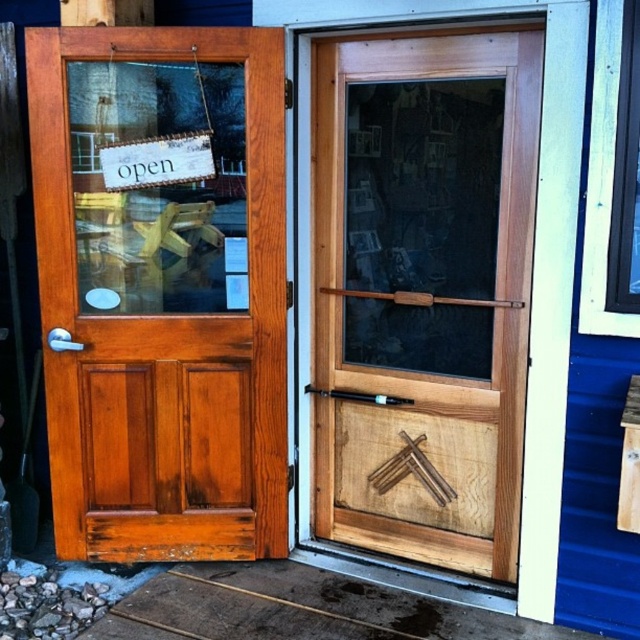
You are a delivery person trying to enter the shop. The shiny brown wood door at left has a sign that says open, but the clear glass window at upper right is partially blocked. Which door should you use to enter?

The shiny brown wood door at left is the correct entrance because the clear glass window at upper right is behind it and partially blocked, making it inaccessible for entry.

You are a delivery person trying to enter the shop. The shiny brown wood door at left and the clear glass window at upper right are in your view. Which object is closer to the ground?

The shiny brown wood door at left is located below the clear glass window at upper right, so it is closer to the ground than the window.

You are standing 10 feet away from the natural wood screen door at center. You want to reach the doorbell that is mounted on the door. Can you comfortably reach it without moving closer?

The natural wood screen door at center is 8.55 feet away from the camera. Since you are standing 10 feet away, you are farther than the door, so you need to move closer to reach the doorbell mounted on the natural wood screen door at center.